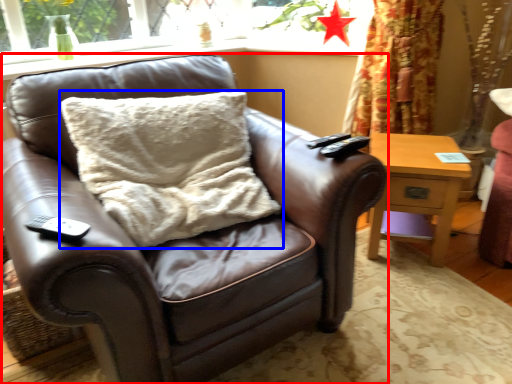
Question: Among these objects, which one is farthest to the camera, chair (highlighted by a red box) or pillow (highlighted by a blue box)?

Choices:
 (A) chair
 (B) pillow

Answer: (B)